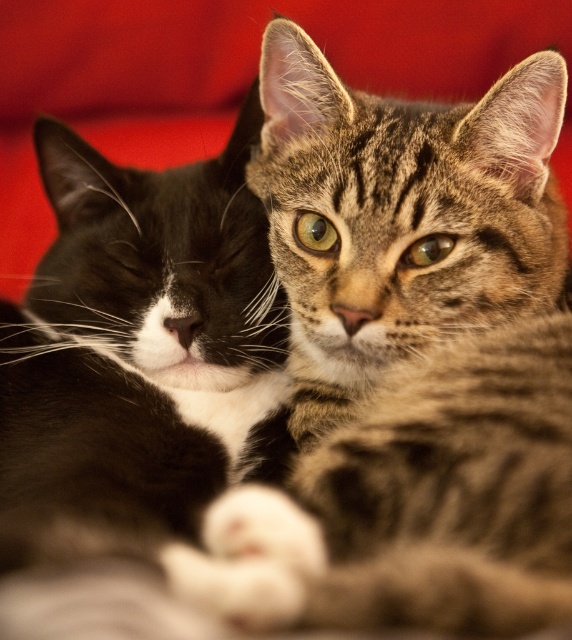
Question: Is tabby fur cat at center wider than soft fur cat at center?

Choices:
 (A) no
 (B) yes

Answer: (B)

Question: Which of the following is the farthest from the observer?

Choices:
 (A) (118, 225)
 (B) (398, 248)

Answer: (A)

Question: Can you confirm if tabby fur cat at center is wider than soft fur cat at center?

Choices:
 (A) no
 (B) yes

Answer: (B)

Question: Which point is farther to the camera?

Choices:
 (A) tabby fur cat at center
 (B) soft fur cat at center

Answer: (A)

Question: Is tabby fur cat at center to the left of soft fur cat at center from the viewer's perspective?

Choices:
 (A) yes
 (B) no

Answer: (B)